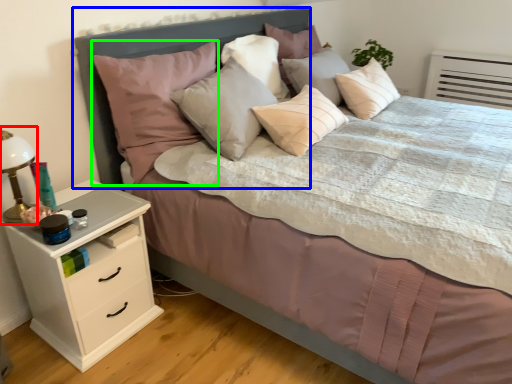
Question: Estimate the real-world distances between objects in this image. Which object is farther from bedside lamp (highlighted by a red box), headboard (highlighted by a blue box) or pillow (highlighted by a green box)?

Choices:
 (A) headboard
 (B) pillow

Answer: (A)